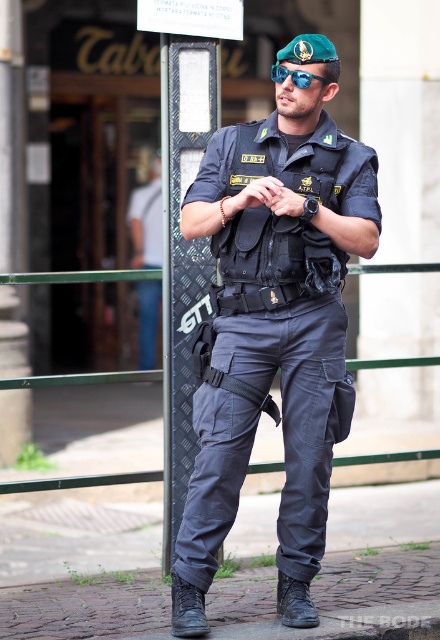
Is matte black uniform at center above blue reflective lens goggles at center?

No, matte black uniform at center is not above blue reflective lens goggles at center.

You are a GUI agent. You are given a task and a screenshot of the screen. Output one action in this format:
    pyautogui.click(x=<x>, y=<y>)
    Task: Click on the matte black uniform at center
    The width and height of the screenshot is (440, 640).
    Given the screenshot: What is the action you would take?
    pyautogui.click(x=275, y=324)